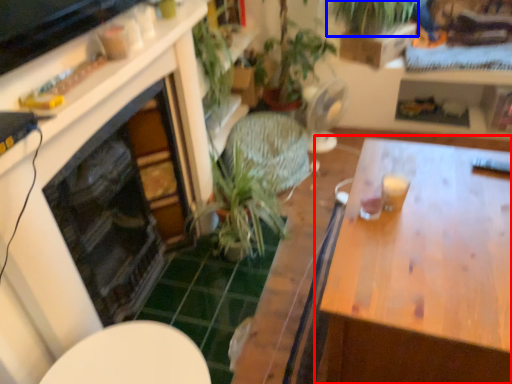
Question: Which point is further to the camera, table (highlighted by a red box) or vegetation (highlighted by a blue box)?

Choices:
 (A) table
 (B) vegetation

Answer: (B)